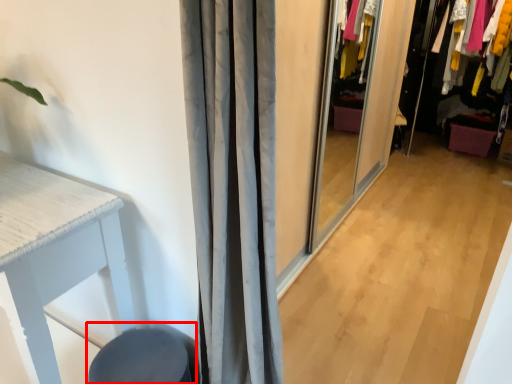
Question: From the image's perspective, where is swivel chair (annotated by the red box) located relative to closet?

Choices:
 (A) above
 (B) below

Answer: (B)